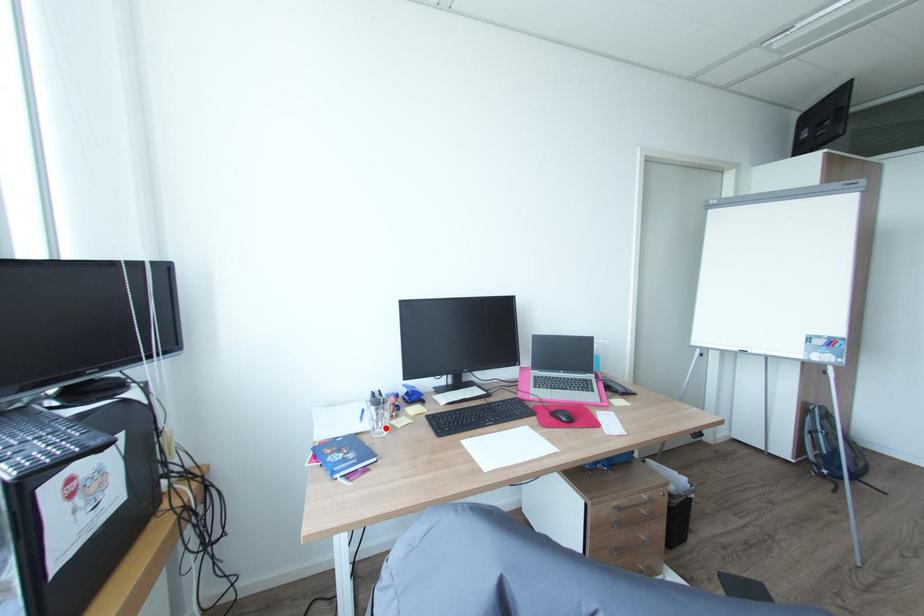
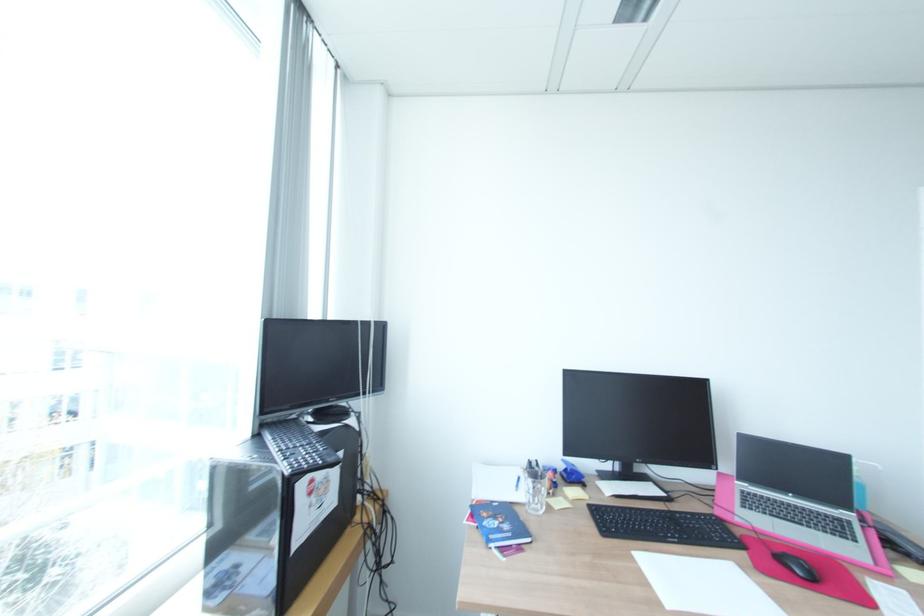
The point at the highlighted location is marked in the first image. Where is the corresponding point in the second image?

(541, 505)